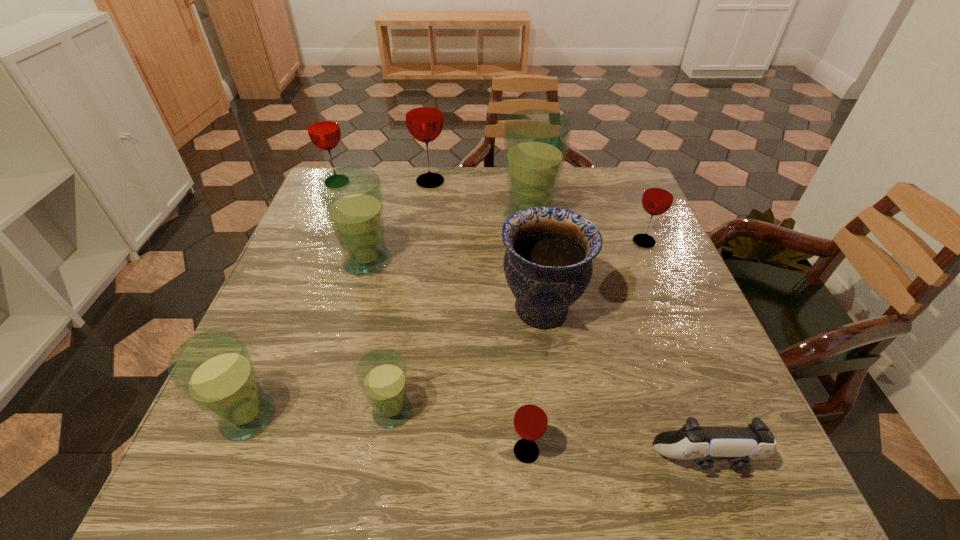
Find the location of a particular element. The image size is (960, 540). blank space located 0.340m on the front handle of the pottery is located at coordinates (343, 309).

This screenshot has width=960, height=540. I want to click on free space located on the front of the rightmost red glass, so click(x=699, y=373).

Image resolution: width=960 pixels, height=540 pixels. Identify the location of vacant space located on the back of the leftmost blue glass. (300, 291).

You are a GUI agent. You are given a task and a screenshot of the screen. Output one action in this format:
    pyautogui.click(x=<x>, y=<y>)
    Task: Click on the vacant region located on the left of the smallest blue glass
    The width and height of the screenshot is (960, 540).
    Given the screenshot: What is the action you would take?
    pyautogui.click(x=325, y=411)

Find the location of a particular element. The height and width of the screenshot is (540, 960). vacant space located 0.260m on the back of the second red glass from right to left is located at coordinates (516, 320).

In order to click on control that is at the near edge in this screenshot , I will do (738, 445).

Locate an element on the screen. This screenshot has height=540, width=960. glass at the right edge is located at coordinates (658, 196).

I want to click on control that is at the right edge, so click(738, 445).

Where is `object located at the far left corner`? Image resolution: width=960 pixels, height=540 pixels. object located at the far left corner is located at coordinates (323, 128).

Identify the location of object positioned at the near left corner. The width and height of the screenshot is (960, 540). (214, 369).